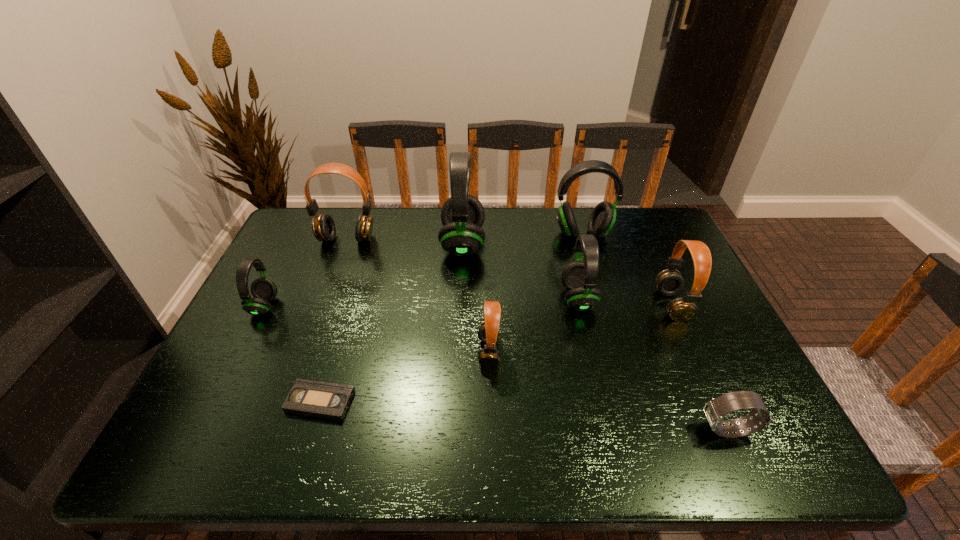
In the image, there is a desktop. Where is `vacant space at the far left corner`? vacant space at the far left corner is located at coordinates (304, 218).

In order to click on blank space at the far right corner of the desktop in this screenshot , I will do `click(674, 246)`.

What are the coordinates of `free point between the third biggest black headset and the shortest object` in the screenshot? It's located at (449, 350).

Locate an element on the screen. This screenshot has width=960, height=540. free space between the second smallest black headset and the second farthest brown headset is located at coordinates (625, 301).

Image resolution: width=960 pixels, height=540 pixels. In order to click on empty location between the farthest brown headset and the third black headset from right to left in this screenshot , I will do `click(405, 241)`.

Locate an element on the screen. The width and height of the screenshot is (960, 540). free area in between the biggest brown headset and the shortest object is located at coordinates (333, 320).

Find the location of `empty location between the third biggest black headset and the rightmost headset`. empty location between the third biggest black headset and the rightmost headset is located at coordinates (625, 301).

In order to click on free point between the second shortest object and the seventh farthest object in this screenshot , I will do `click(608, 390)`.

Locate an element on the screen. The height and width of the screenshot is (540, 960). free space between the third biggest black headset and the watch is located at coordinates click(x=653, y=364).

The height and width of the screenshot is (540, 960). Find the location of `free space between the third biggest black headset and the watch`. free space between the third biggest black headset and the watch is located at coordinates (653, 364).